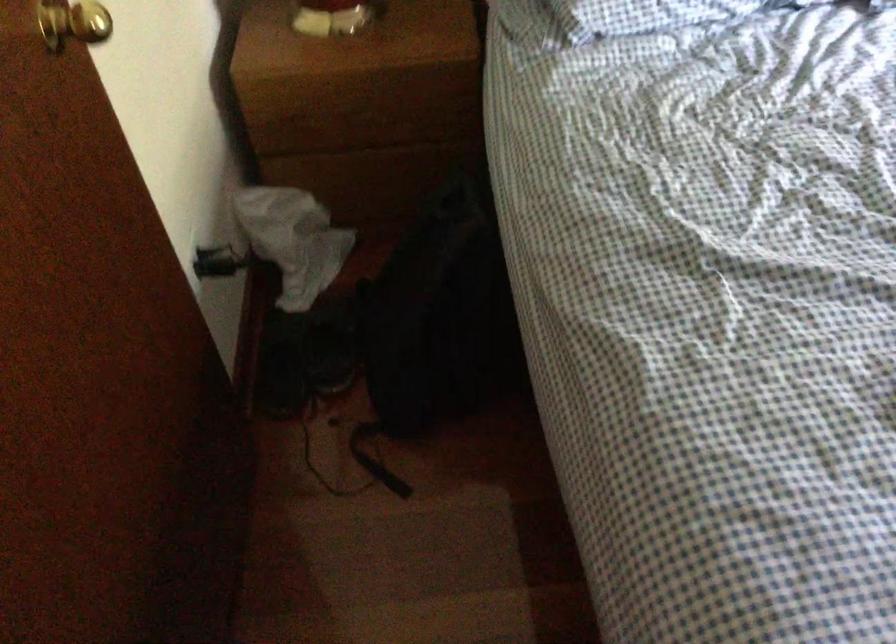
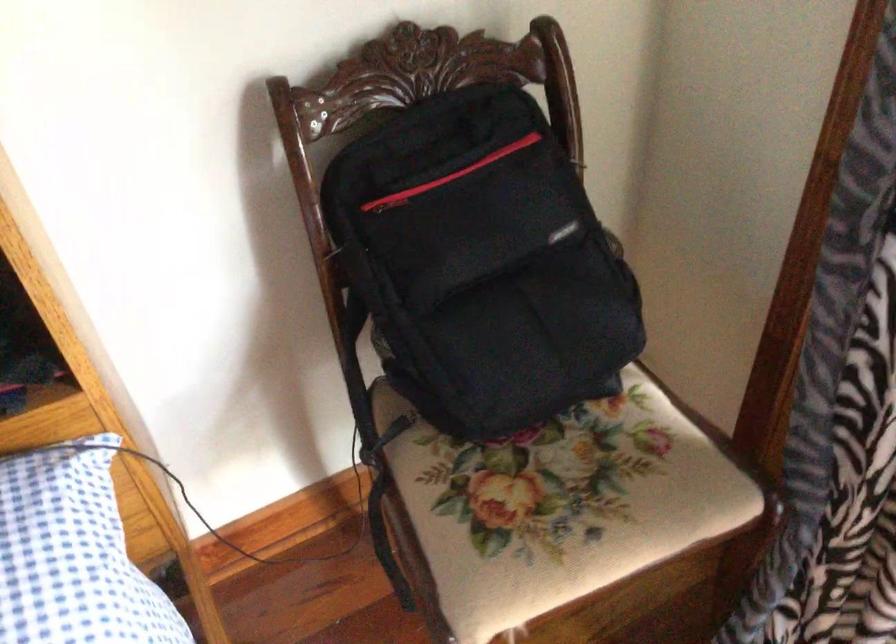
The images are taken continuously from a first-person perspective. In which direction are you moving?

The movement direction of the cameraman is right, forward.